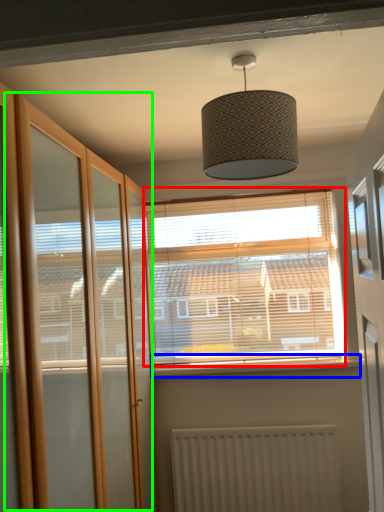
Question: Which is farther away from window (highlighted by a red box)? window sill (highlighted by a blue box) or screen door (highlighted by a green box)?

Choices:
 (A) window sill
 (B) screen door

Answer: (B)